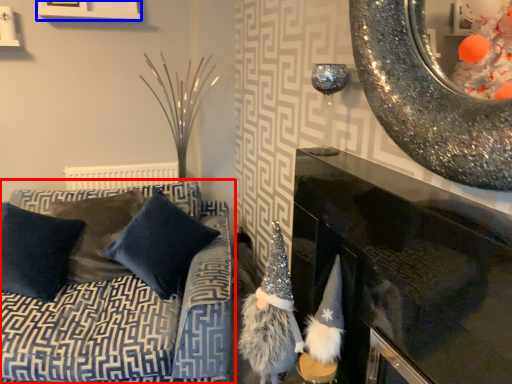
Question: Which of the following is the farthest to the observer, studio couch (highlighted by a red box) or picture frame (highlighted by a blue box)?

Choices:
 (A) studio couch
 (B) picture frame

Answer: (B)